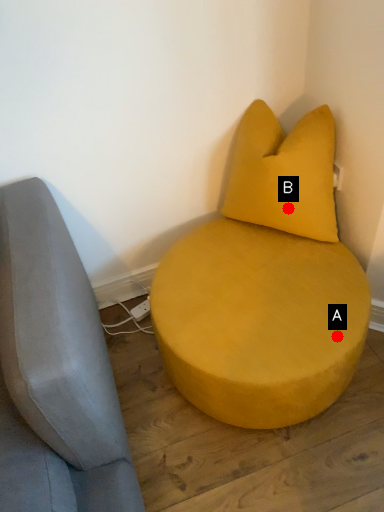
Question: Two points are circled on the image, labeled by A and B beside each circle. Which point appears farthest from the camera in this image?

Choices:
 (A) A is further
 (B) B is further

Answer: (B)